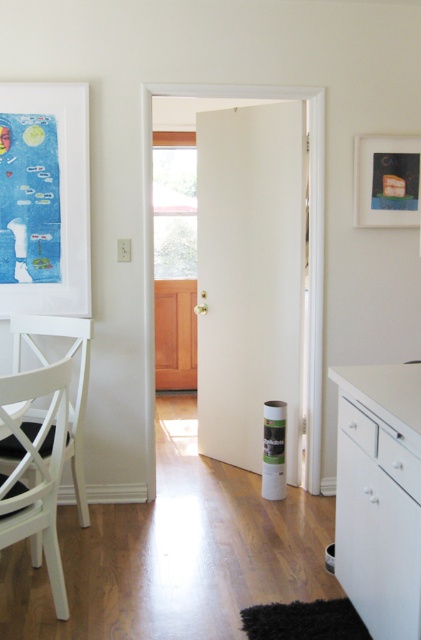
Question: From the image, what is the correct spatial relationship of white glossy cabinet at lower right in relation to matte white picture frame at upper left?

Choices:
 (A) above
 (B) below

Answer: (B)

Question: Can you confirm if white matte chair at left is positioned to the left of matte black picture frame at upper right?

Choices:
 (A) yes
 (B) no

Answer: (A)

Question: Which of the following is the farthest from the observer?

Choices:
 (A) matte black picture frame at upper right
 (B) matte white picture frame at upper left
 (C) white glossy cabinet at lower right

Answer: (A)

Question: Considering the real-world distances, which object is closest to the white matte chair at left?

Choices:
 (A) white glossy cabinet at lower right
 (B) matte white picture frame at upper left
 (C) matte black picture frame at upper right

Answer: (A)

Question: Is white matte chair at left to the left of matte black picture frame at upper right from the viewer's perspective?

Choices:
 (A) no
 (B) yes

Answer: (B)

Question: Which point is farther from the camera taking this photo?

Choices:
 (A) (8, 508)
 (B) (359, 134)
 (C) (402, 413)

Answer: (B)